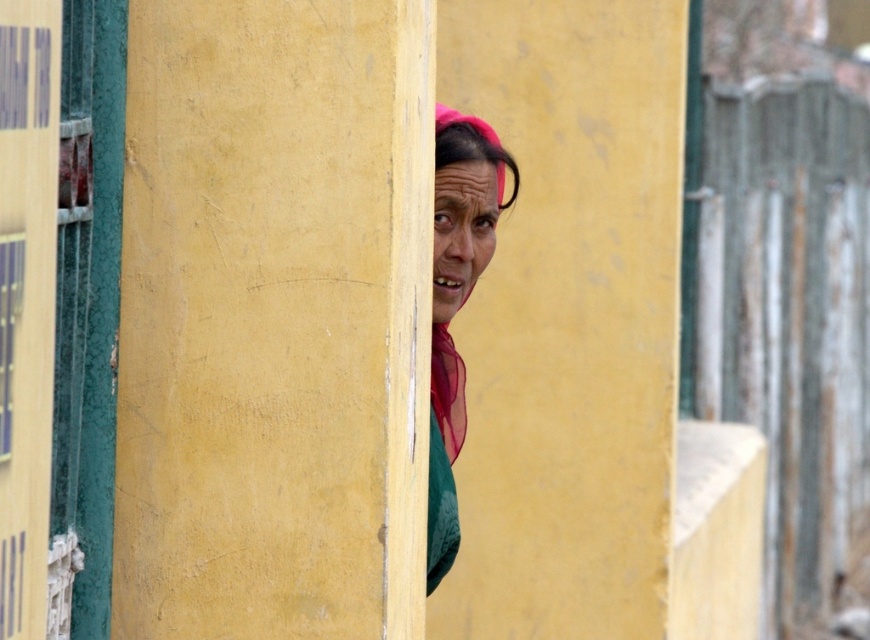
Question: Which point is closer to the camera?

Choices:
 (A) (480, 131)
 (B) (449, 420)

Answer: (A)

Question: Is translucent pink shawl at center to the left of pink fabric headscarf at center from the viewer's perspective?

Choices:
 (A) no
 (B) yes

Answer: (B)

Question: Is pink sheer scarf at center positioned behind translucent pink shawl at center?

Choices:
 (A) no
 (B) yes

Answer: (A)

Question: Can you confirm if pink sheer scarf at center is thinner than translucent pink shawl at center?

Choices:
 (A) no
 (B) yes

Answer: (A)

Question: Among these points, which one is farthest from the camera?

Choices:
 (A) (443, 236)
 (B) (480, 131)

Answer: (B)

Question: Which object appears closest to the camera in this image?

Choices:
 (A) pink sheer scarf at center
 (B) pink fabric headscarf at center
 (C) translucent pink shawl at center

Answer: (A)